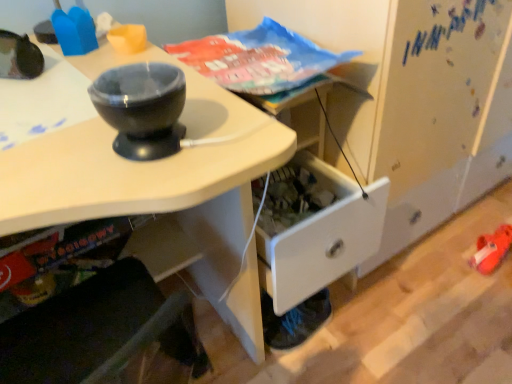
Question: Considering the positions of point (296, 329) and point (237, 233), is point (296, 329) closer or farther from the camera than point (237, 233)?

Choices:
 (A) farther
 (B) closer

Answer: (A)

Question: Would you say blue fabric shoe at lower right is inside or outside white glossy desk at center?

Choices:
 (A) outside
 (B) inside

Answer: (A)

Question: Considering the positions of blue fabric shoe at lower right and white glossy desk at center in the image, is blue fabric shoe at lower right wider or thinner than white glossy desk at center?

Choices:
 (A) thin
 (B) wide

Answer: (A)

Question: From the image's perspective, is white glossy desk at center positioned above or below blue fabric shoe at lower right?

Choices:
 (A) above
 (B) below

Answer: (A)

Question: From their relative heights in the image, would you say white glossy desk at center is taller or shorter than blue fabric shoe at lower right?

Choices:
 (A) short
 (B) tall

Answer: (B)

Question: In the image, is white glossy desk at center on the left side or the right side of blue fabric shoe at lower right?

Choices:
 (A) left
 (B) right

Answer: (A)

Question: Looking at their shapes, would you say white glossy desk at center is wider or thinner than blue fabric shoe at lower right?

Choices:
 (A) thin
 (B) wide

Answer: (B)